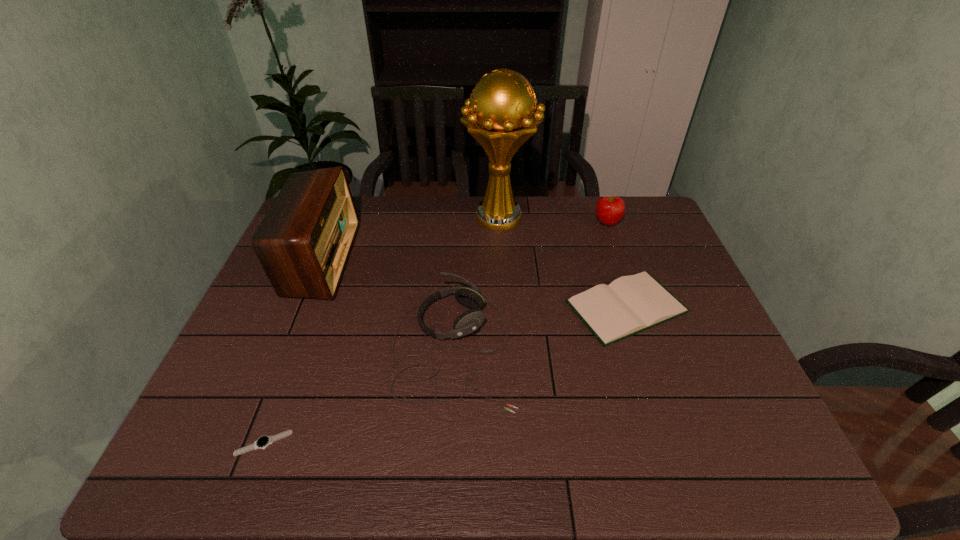
Locate an element on the screen. This screenshot has width=960, height=540. blank space that satisfies the following two spatial constraints: 1. at the front of the tallest object where the globe is prominent; 2. on the left side of the hardback book is located at coordinates (504, 307).

The image size is (960, 540). I want to click on vacant space that satisfies the following two spatial constraints: 1. on the front-facing side of the shortest object; 2. on the right side of the fifth shortest object, so click(247, 443).

You are a GUI agent. You are given a task and a screenshot of the screen. Output one action in this format:
    pyautogui.click(x=<x>, y=<y>)
    Task: Click on the free space that satisfies the following two spatial constraints: 1. on the front-facing side of the fifth shortest object; 2. on the right side of the nearest object
    The width and height of the screenshot is (960, 540).
    Given the screenshot: What is the action you would take?
    pyautogui.click(x=247, y=443)